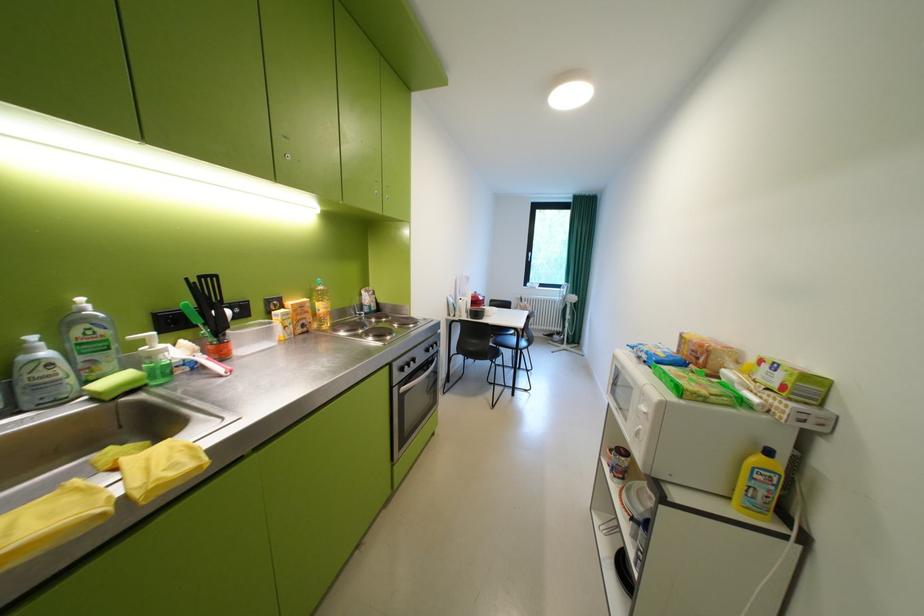
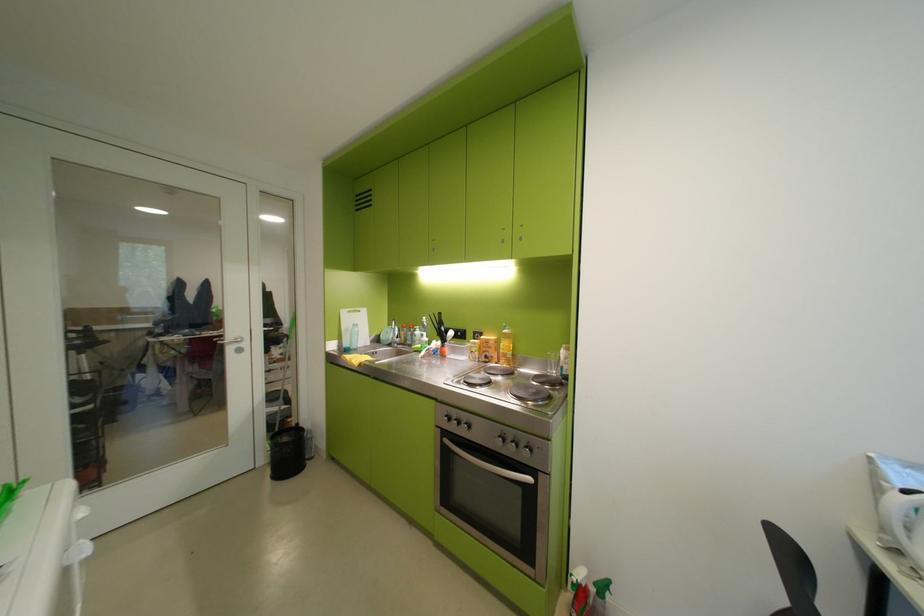
Find the pixel in the second image that matches pixel 317 313 in the first image.

(501, 349)